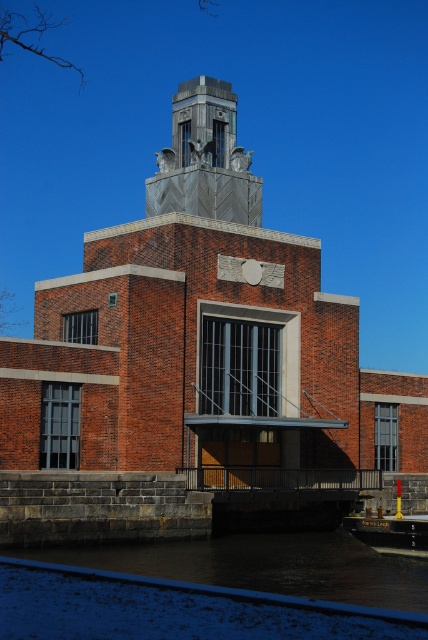
Is point (128, 508) behind point (223, 548)?

That is False.

Who is positioned more to the left, brick building at center or dark water at lower center?

From the viewer's perspective, brick building at center appears more on the left side.

Who is more distant from viewer, (247, 172) or (285, 588)?

Positioned behind is point (247, 172).

Find the location of a particular element. brick building at center is located at coordinates (196, 368).

Does dark water at lower center appear over metallic gray bell tower at center?

Incorrect, dark water at lower center is not positioned above metallic gray bell tower at center.

Is dark water at lower center shorter than metallic gray bell tower at center?

Yes.

Between point (333, 573) and point (220, 205), which one is positioned behind?

The point (220, 205) is behind.

At what (x,y) coordinates should I click in order to perform the action: click on dark water at lower center. Please return your answer as a coordinate pair (x, y). This screenshot has width=428, height=640. Looking at the image, I should click on (264, 564).

Who is taller, brick building at center or metallic gray bell tower at center?

brick building at center is taller.

Who is more forward, (416, 401) or (202, 161)?

Point (202, 161) is more forward.

Does point (300, 332) come farther from viewer compared to point (249, 192)?

No, it is not.

The width and height of the screenshot is (428, 640). In order to click on brick building at center in this screenshot , I will do `click(196, 368)`.